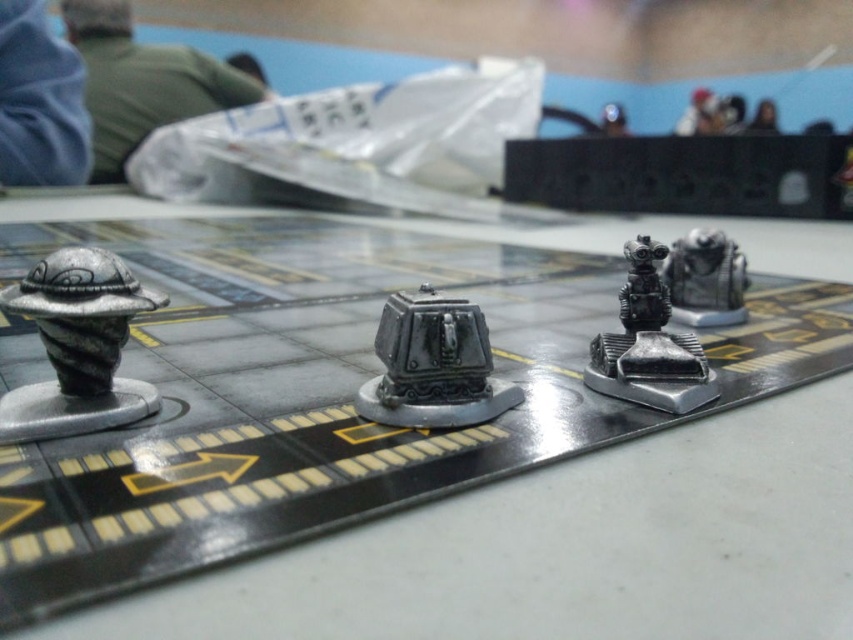
Question: Which object is positioned farthest from the metallic silver robot at center?

Choices:
 (A) silver metallic spaceship at left
 (B) metallic gray cube at center
 (C) metallic robot at center

Answer: (A)

Question: Which object is closer to the camera taking this photo?

Choices:
 (A) metallic robot at center
 (B) silver metallic spaceship at left
 (C) metallic silver robot at center
 (D) metallic gray cube at center

Answer: (B)

Question: Is silver metallic spaceship at left smaller than metallic robot at center?

Choices:
 (A) yes
 (B) no

Answer: (B)

Question: In this image, where is metallic gray cube at center located relative to metallic robot at center?

Choices:
 (A) right
 (B) left

Answer: (B)

Question: Which point is closer to the camera taking this photo?

Choices:
 (A) (628, 339)
 (B) (68, 317)
 (C) (396, 408)
 (D) (817, 260)

Answer: (B)

Question: Is silver metallic spaceship at left smaller than metallic gray cube at center?

Choices:
 (A) no
 (B) yes

Answer: (A)